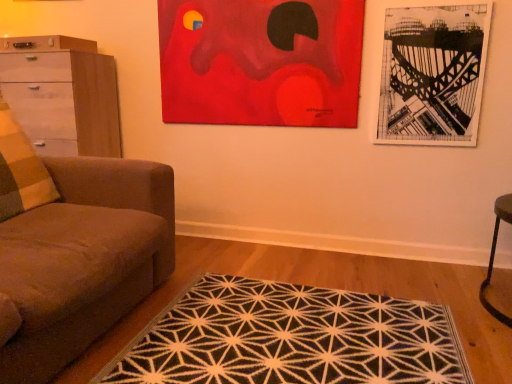
Where is `free space to the back side of black geometric rug at center`? This screenshot has height=384, width=512. free space to the back side of black geometric rug at center is located at coordinates (291, 262).